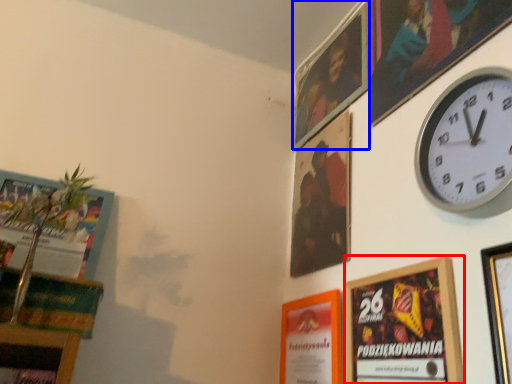
Question: Among these objects, which one is nearest to the camera, picture frame (highlighted by a red box) or picture frame (highlighted by a blue box)?

Choices:
 (A) picture frame
 (B) picture frame

Answer: (A)